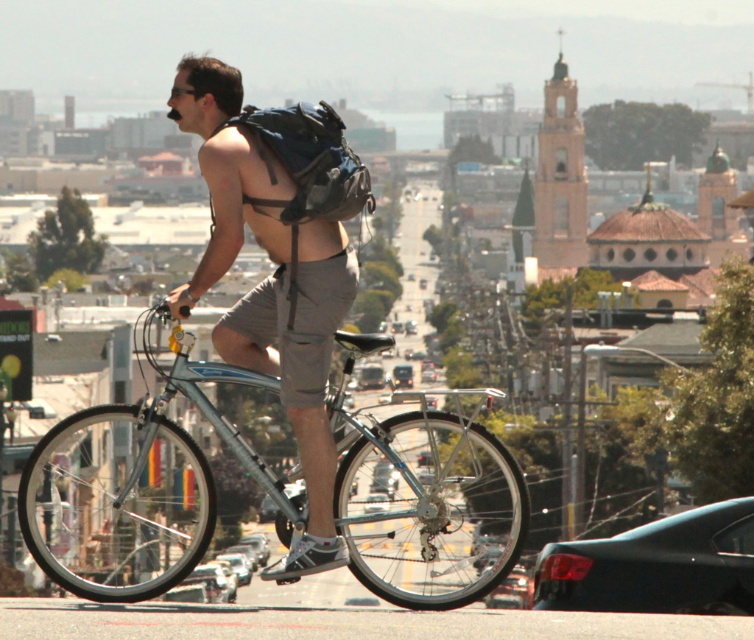
Does matte gray shorts at center have a smaller size compared to matte blue backpack at center?

Actually, matte gray shorts at center might be larger than matte blue backpack at center.

Between matte gray shorts at center and matte blue backpack at center, which one is positioned higher?

Positioned higher is matte blue backpack at center.

Is point (290, 401) positioned before point (348, 211)?

Yes, it is.

Where is `matte gray shorts at center`? The image size is (754, 640). matte gray shorts at center is located at coordinates (268, 285).

Can you confirm if silver metallic bicycle at center is bigger than matte blue backpack at center?

Yes, silver metallic bicycle at center is bigger than matte blue backpack at center.

Measure the distance between silver metallic bicycle at center and matte blue backpack at center.

silver metallic bicycle at center and matte blue backpack at center are 58.05 meters apart from each other.

Between point (274, 497) and point (296, 115), which one is positioned behind?

The point (296, 115) is more distant.

Identify the location of silver metallic bicycle at center. (136, 486).

Between gray/knit shorts at center and matte blue backpack at center, which one appears on the left side from the viewer's perspective?

gray/knit shorts at center is more to the left.

In the scene shown: Which of these two, gray/knit shorts at center or matte blue backpack at center, stands shorter?

Standing shorter between the two is gray/knit shorts at center.

Who is more distant from viewer, (x=264, y=298) or (x=328, y=208)?

Point (x=264, y=298)

In order to click on gray/knit shorts at center in this screenshot , I will do `click(296, 323)`.